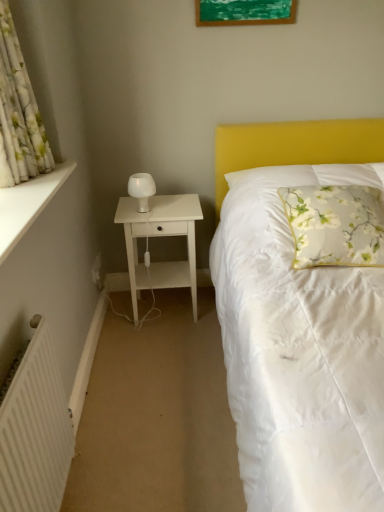
Question: Is floral fabric pillow at center far away from white painted wood at left?

Choices:
 (A) yes
 (B) no

Answer: (A)

Question: Can you confirm if floral fabric pillow at center is taller than white painted wood at left?

Choices:
 (A) no
 (B) yes

Answer: (B)

Question: From a real-world perspective, does floral fabric pillow at center stand above white painted wood at left?

Choices:
 (A) yes
 (B) no

Answer: (B)

Question: Is floral fabric pillow at center positioned in front of white painted wood at left?

Choices:
 (A) yes
 (B) no

Answer: (B)

Question: Is the position of floral fabric pillow at center more distant than that of white painted wood at left?

Choices:
 (A) no
 (B) yes

Answer: (B)

Question: Can you confirm if floral fabric pillow at center is shorter than white painted wood at left?

Choices:
 (A) yes
 (B) no

Answer: (B)

Question: Is white painted wood at left shorter than green matte picture frame at upper center?

Choices:
 (A) yes
 (B) no

Answer: (A)

Question: From a real-world perspective, does white painted wood at left stand above green matte picture frame at upper center?

Choices:
 (A) yes
 (B) no

Answer: (B)

Question: From the image's perspective, is white painted wood at left below green matte picture frame at upper center?

Choices:
 (A) no
 (B) yes

Answer: (B)

Question: Does white painted wood at left have a greater height compared to green matte picture frame at upper center?

Choices:
 (A) no
 (B) yes

Answer: (A)

Question: Does white painted wood at left have a lesser width compared to green matte picture frame at upper center?

Choices:
 (A) yes
 (B) no

Answer: (B)

Question: Can we say white painted wood at left lies outside green matte picture frame at upper center?

Choices:
 (A) no
 (B) yes

Answer: (B)

Question: Is green matte picture frame at upper center not inside floral fabric pillow at center?

Choices:
 (A) no
 (B) yes

Answer: (B)